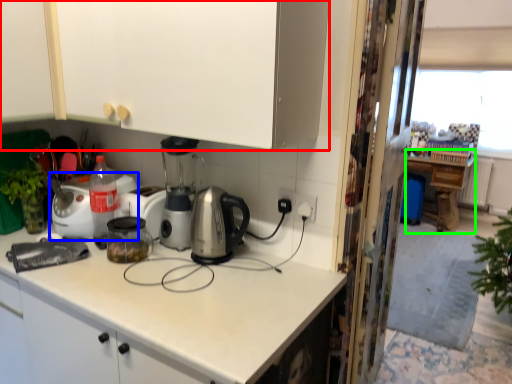
Question: Which object is the farthest from cabinetry (highlighted by a red box)? Choose among these: home appliance (highlighted by a blue box) or table (highlighted by a green box).

Choices:
 (A) home appliance
 (B) table

Answer: (B)